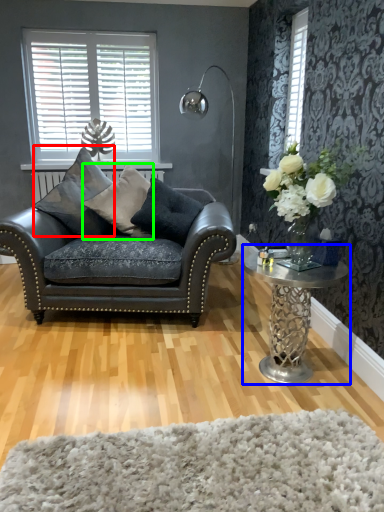
Question: Estimate the real-world distances between objects in this image. Which object is farther from pillow (highlighted by a red box), coffee table (highlighted by a blue box) or pillow (highlighted by a green box)?

Choices:
 (A) coffee table
 (B) pillow

Answer: (A)